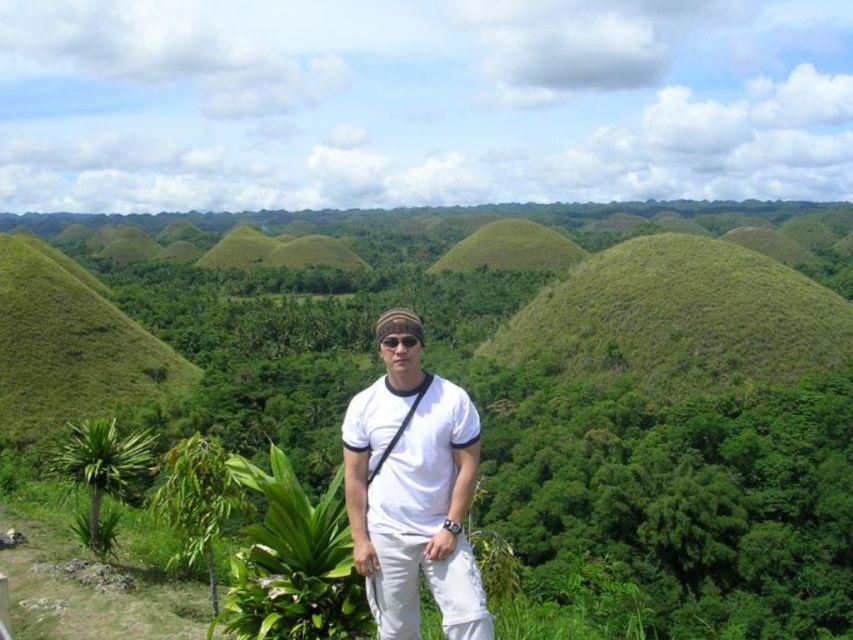
Which is behind, point (380, 476) or point (386, 344)?

The point (386, 344) is behind.

Between point (369, 589) and point (415, 337), which one is positioned behind?

The point (415, 337) is more distant.

You are a GUI agent. You are given a task and a screenshot of the screen. Output one action in this format:
    pyautogui.click(x=<x>, y=<y>)
    Task: Click on the white cotton shirt at center
    
    Given the screenshot: What is the action you would take?
    pyautogui.click(x=413, y=497)

Does green leafy vegetation at center have a lesser height compared to green grassy mound at center-right?

No.

Between point (102, 246) and point (844, 358), which one is positioned behind?

The point (102, 246) is more distant.

Measure the distance between green leafy vegetation at center and camera.

They are 24.40 meters apart.

This screenshot has width=853, height=640. I want to click on green leafy vegetation at center, so click(x=558, y=384).

Between green grassy mound at center-right and black matte sunglasses at center, which one has more height?

green grassy mound at center-right

Between point (608, 273) and point (410, 340), which one is positioned behind?

The point (608, 273) is behind.

Is point (641, 369) behind point (378, 346)?

Yes, point (641, 369) is behind point (378, 346).

Find the location of a particular element. Image resolution: width=853 pixels, height=640 pixels. green grassy mound at center-right is located at coordinates (677, 317).